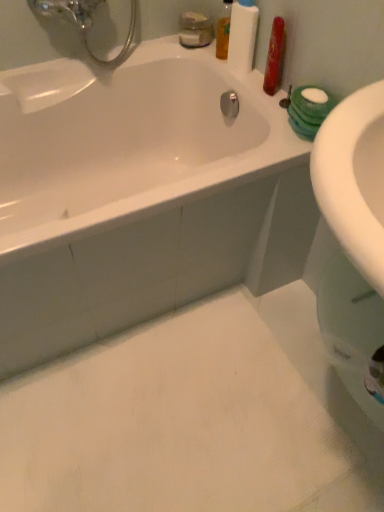
Question: In terms of height, does translucent orange liquid at upper right, the first mouthwash viewed from the right, look taller or shorter compared to white matte bottle at upper right?

Choices:
 (A) tall
 (B) short

Answer: (B)

Question: Which is correct: translucent orange liquid at upper right, the 2th mouthwash from the left, is inside white matte bottle at upper right, or outside of it?

Choices:
 (A) outside
 (B) inside

Answer: (A)

Question: Estimate the real-world distances between objects in this image. Which object is closer to the white glossy bathtub at upper left?

Choices:
 (A) white matte bottle at upper right
 (B) translucent plastic mouthwash at upper center, acting as the 1th mouthwash starting from the left
 (C) translucent orange liquid at upper right, the 2th mouthwash from the left

Answer: (A)

Question: Estimate the real-world distances between objects in this image. Which object is farther from the white matte bottle at upper right?

Choices:
 (A) translucent plastic mouthwash at upper center, acting as the 1th mouthwash starting from the left
 (B) translucent orange liquid at upper right, the 2th mouthwash from the left
 (C) white glossy bathtub at upper left

Answer: (C)